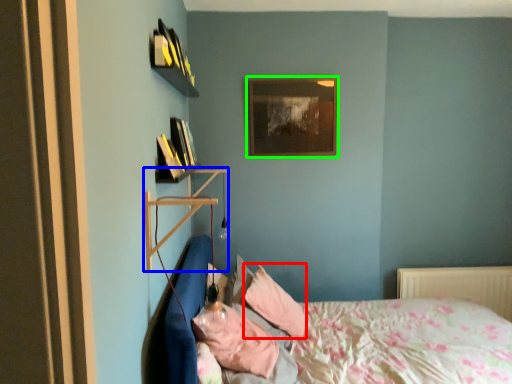
Question: Considering the real-world distances, which object is farthest from pillow (highlighted by a red box)? shelf (highlighted by a blue box) or picture frame (highlighted by a green box)?

Choices:
 (A) shelf
 (B) picture frame

Answer: (B)